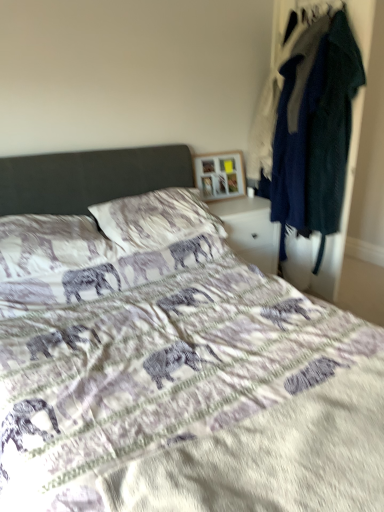
Locate an element on the screen. This screenshot has height=512, width=384. free space above white glossy nightstand at center (from a real-world perspective) is located at coordinates (230, 203).